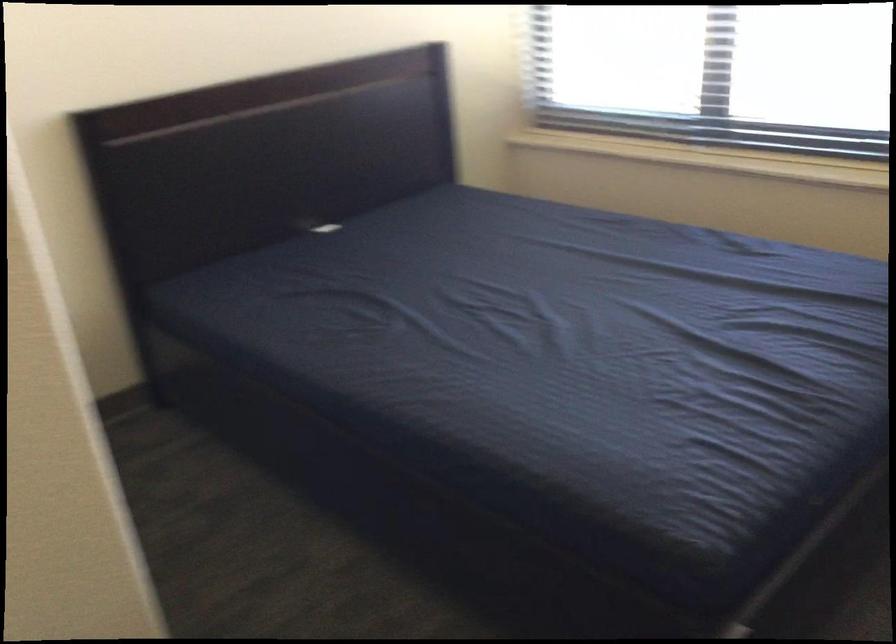
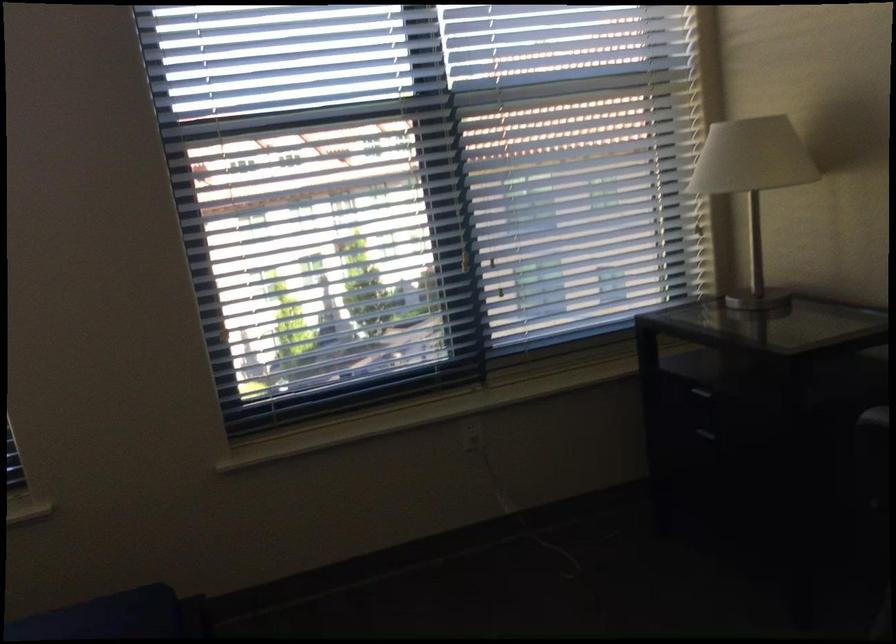
Question: The camera is either moving clockwise (left) or counter-clockwise (right) around the object. The first image is from the beginning of the video and the second image is from the end. Is the camera moving left or right when shooting the video?

Choices:
 (A) Left
 (B) Right

Answer: (A)